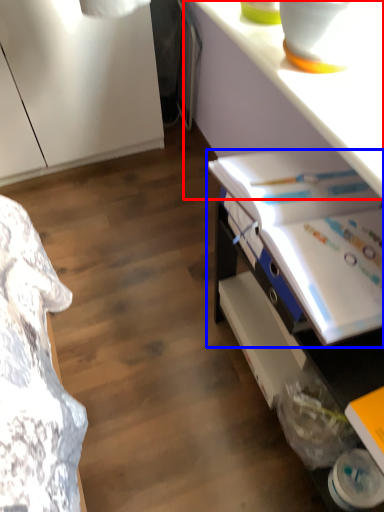
Question: Which point is closer to the camera, counter top (highlighted by a red box) or book (highlighted by a blue box)?

Choices:
 (A) counter top
 (B) book

Answer: (A)